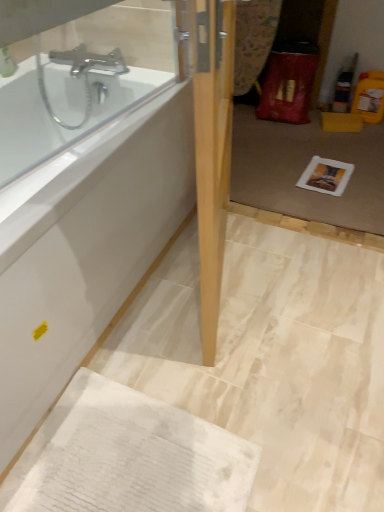
At what (x,y) coordinates should I click in order to perform the action: click on free spot to the right of white textured towel at lower left. Please return your answer as a coordinate pair (x, y). This screenshot has width=384, height=512. Looking at the image, I should click on (296, 412).